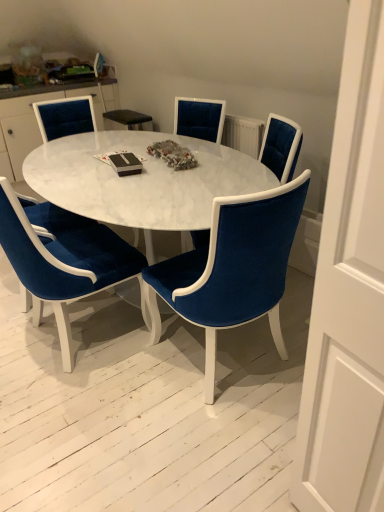
This screenshot has height=512, width=384. What are the coordinates of `vacant space positioned to the left of velvet blue chair at center, which is the fourth chair in left-to-right order` in the screenshot? It's located at (110, 389).